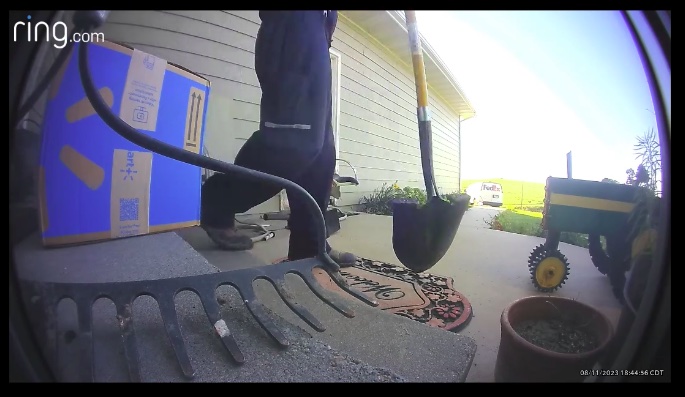
Locate an element on the screen. The image size is (685, 397). welcome mat is located at coordinates (371, 264).